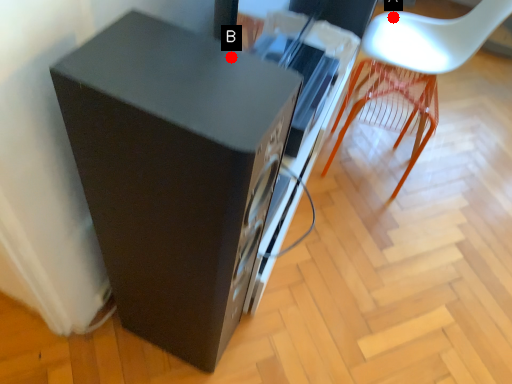
Question: Two points are circled on the image, labeled by A and B beside each circle. Which point is closer to the camera taking this photo?

Choices:
 (A) A is closer
 (B) B is closer

Answer: (B)